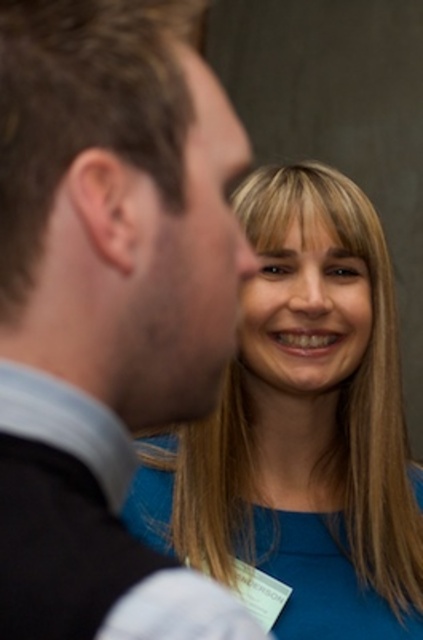
You are an event planner organizing a photo shoot. You need to place a decorative pin on the blue fabric shirt at center. According to the image coordinates, where should you place it?

The blue fabric shirt at center is located at point (304, 429), so you should place the decorative pin there.

You are at a networking event and notice two hair colors in your field of view. The dark brown hair at left and the brown matte hair at upper left. Which one is positioned to the right of the other?

The dark brown hair at left is positioned to the right of the brown matte hair at upper left.